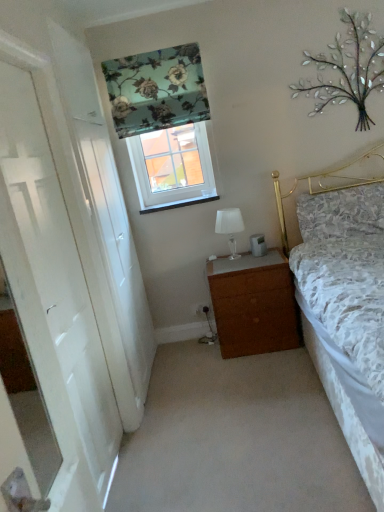
The image size is (384, 512). Identify the location of free point in front of brown wood chest of drawers at center. (244, 372).